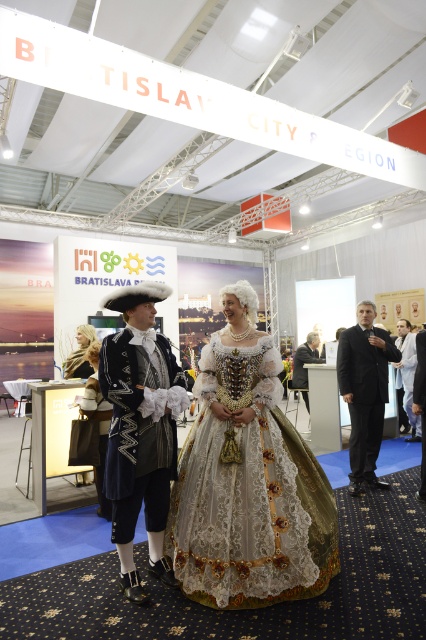
You are an event planner at the Bratislava City Region exhibition. You need to arrange a photo shoot where the lace fabric dress at center and the white fabric suit at center are both visible. Based on their positions, which one should be placed higher in the frame to ensure both are visible?

The lace fabric dress at center is below the white fabric suit at center, so to ensure both are visible in the photo shoot, the white fabric suit at center should be placed higher in the frame.